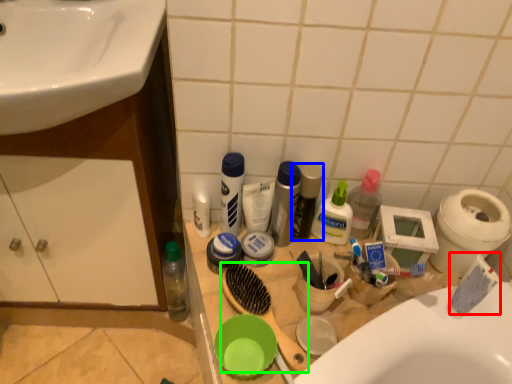
Question: Considering the real-world distances, which object is closest to toothpaste (highlighted by a red box)? toiletry (highlighted by a blue box) or brush (highlighted by a green box).

Choices:
 (A) toiletry
 (B) brush

Answer: (A)